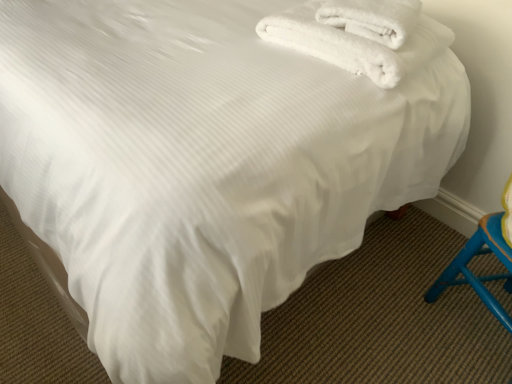
What do you see at coordinates (357, 37) in the screenshot?
I see `white fluffy towels at upper right, positioned as the second towel in right-to-left order` at bounding box center [357, 37].

Where is `white fluffy towels at upper right, the 1th towel in the left-to-right sequence`? The image size is (512, 384). white fluffy towels at upper right, the 1th towel in the left-to-right sequence is located at coordinates click(357, 37).

What is the approximate width of white fluffy towels at upper right, the 1th towel in the left-to-right sequence?

The width of white fluffy towels at upper right, the 1th towel in the left-to-right sequence, is 14.56 inches.

At what (x,y) coordinates should I click in order to perform the action: click on white fluffy towel at upper right, which is the second towel from left to right. Please return your answer as a coordinate pair (x, y). Looking at the image, I should click on (372, 18).

What is the approximate height of white fluffy towel at upper right, which is the first towel in right-to-left order?

white fluffy towel at upper right, which is the first towel in right-to-left order, is 2.32 inches tall.

In order to face white fluffy towel at upper right, which is the second towel from left to right, should I rotate leftwards or rightwards?

You should look right and rotate roughly 15.239 degrees.

What do you see at coordinates (372, 18) in the screenshot? I see `white fluffy towel at upper right, which is the second towel from left to right` at bounding box center [372, 18].

You are a GUI agent. You are given a task and a screenshot of the screen. Output one action in this format:
    pyautogui.click(x=<x>, y=<y>)
    Task: Click on the white fluffy towels at upper right, the 1th towel in the left-to-right sequence
    The height and width of the screenshot is (384, 512).
    Given the screenshot: What is the action you would take?
    pyautogui.click(x=357, y=37)

Based on their positions, is white fluffy towels at upper right, positioned as the second towel in right-to-left order, located to the left or right of white fluffy towel at upper right, which is the first towel in right-to-left order?

In the image, white fluffy towels at upper right, positioned as the second towel in right-to-left order, appears on the left side of white fluffy towel at upper right, which is the first towel in right-to-left order.

Which is in front, white fluffy towels at upper right, positioned as the second towel in right-to-left order, or white fluffy towel at upper right, which is the first towel in right-to-left order?

Positioned in front is white fluffy towels at upper right, positioned as the second towel in right-to-left order.

Does point (338, 34) lie in front of point (359, 9)?

That is True.

From the image's perspective, is white fluffy towels at upper right, the 1th towel in the left-to-right sequence, over white fluffy towel at upper right, which is the second towel from left to right?

Actually, white fluffy towels at upper right, the 1th towel in the left-to-right sequence, appears below white fluffy towel at upper right, which is the second towel from left to right, in the image.

From a real-world perspective, is white fluffy towels at upper right, the 1th towel in the left-to-right sequence, under white fluffy towel at upper right, which is the second towel from left to right?

Yes.

Which of these two, white fluffy towels at upper right, the 1th towel in the left-to-right sequence, or white fluffy towel at upper right, which is the first towel in right-to-left order, is wider?

white fluffy towels at upper right, the 1th towel in the left-to-right sequence, is wider.

Which of these two, white fluffy towels at upper right, the 1th towel in the left-to-right sequence, or white fluffy towel at upper right, which is the second towel from left to right, stands taller?

With more height is white fluffy towels at upper right, the 1th towel in the left-to-right sequence.

Who is bigger, white fluffy towels at upper right, positioned as the second towel in right-to-left order, or white fluffy towel at upper right, which is the first towel in right-to-left order?

white fluffy towels at upper right, positioned as the second towel in right-to-left order.

Choose the correct answer: Is white fluffy towels at upper right, positioned as the second towel in right-to-left order, inside white fluffy towel at upper right, which is the second towel from left to right, or outside it?

white fluffy towels at upper right, positioned as the second towel in right-to-left order, is outside white fluffy towel at upper right, which is the second towel from left to right.

In the scene shown: Are white fluffy towels at upper right, the 1th towel in the left-to-right sequence, and white fluffy towel at upper right, which is the second towel from left to right, beside each other?

Yes, white fluffy towels at upper right, the 1th towel in the left-to-right sequence, is with white fluffy towel at upper right, which is the second towel from left to right.

Is white fluffy towels at upper right, positioned as the second towel in right-to-left order, facing towards white fluffy towel at upper right, which is the second towel from left to right?

No, white fluffy towels at upper right, positioned as the second towel in right-to-left order, is not facing towards white fluffy towel at upper right, which is the second towel from left to right.

What's the angular difference between white fluffy towels at upper right, positioned as the second towel in right-to-left order, and white fluffy towel at upper right, which is the first towel in right-to-left order,'s facing directions?

The facing directions of white fluffy towels at upper right, positioned as the second towel in right-to-left order, and white fluffy towel at upper right, which is the first towel in right-to-left order, are 6.34 degrees apart.

Measure the distance between white fluffy towels at upper right, positioned as the second towel in right-to-left order, and white fluffy towel at upper right, which is the first towel in right-to-left order.

They are 1.32 inches apart.

The width and height of the screenshot is (512, 384). What are the coordinates of `towel on the right side of white fluffy towels at upper right, the 1th towel in the left-to-right sequence` in the screenshot? It's located at (372, 18).

Consider the image. Can you confirm if white fluffy towel at upper right, which is the second towel from left to right, is positioned to the right of white fluffy towels at upper right, the 1th towel in the left-to-right sequence?

Yes, white fluffy towel at upper right, which is the second towel from left to right, is to the right of white fluffy towels at upper right, the 1th towel in the left-to-right sequence.

Is white fluffy towel at upper right, which is the first towel in right-to-left order, behind white fluffy towels at upper right, the 1th towel in the left-to-right sequence?

Yes, the depth of white fluffy towel at upper right, which is the first towel in right-to-left order, is greater than that of white fluffy towels at upper right, the 1th towel in the left-to-right sequence.

Does point (401, 38) lie in front of point (340, 2)?

Yes, it is.

From the image's perspective, relative to white fluffy towels at upper right, positioned as the second towel in right-to-left order, is white fluffy towel at upper right, which is the first towel in right-to-left order, above or below?

white fluffy towel at upper right, which is the first towel in right-to-left order, is situated higher than white fluffy towels at upper right, positioned as the second towel in right-to-left order, in the image.

From a real-world perspective, is white fluffy towel at upper right, which is the first towel in right-to-left order, positioned under white fluffy towels at upper right, positioned as the second towel in right-to-left order, based on gravity?

No, from a real-world perspective, white fluffy towel at upper right, which is the first towel in right-to-left order, is not below white fluffy towels at upper right, positioned as the second towel in right-to-left order.

Considering the sizes of objects white fluffy towel at upper right, which is the second towel from left to right, and white fluffy towels at upper right, the 1th towel in the left-to-right sequence, in the image provided, who is wider, white fluffy towel at upper right, which is the second towel from left to right, or white fluffy towels at upper right, the 1th towel in the left-to-right sequence,?

Wider between the two is white fluffy towels at upper right, the 1th towel in the left-to-right sequence.

Considering the sizes of objects white fluffy towel at upper right, which is the second towel from left to right, and white fluffy towels at upper right, the 1th towel in the left-to-right sequence, in the image provided, who is taller, white fluffy towel at upper right, which is the second towel from left to right, or white fluffy towels at upper right, the 1th towel in the left-to-right sequence,?

white fluffy towels at upper right, the 1th towel in the left-to-right sequence.

Who is smaller, white fluffy towel at upper right, which is the second towel from left to right, or white fluffy towels at upper right, positioned as the second towel in right-to-left order?

With smaller size is white fluffy towel at upper right, which is the second towel from left to right.

Can white fluffy towels at upper right, positioned as the second towel in right-to-left order, be found inside white fluffy towel at upper right, which is the first towel in right-to-left order?

No, white fluffy towels at upper right, positioned as the second towel in right-to-left order, is not surrounded by white fluffy towel at upper right, which is the first towel in right-to-left order.

Are white fluffy towel at upper right, which is the second towel from left to right, and white fluffy towels at upper right, the 1th towel in the left-to-right sequence, located far from each other?

They are positioned close to each other.

Looking at this image, is white fluffy towels at upper right, positioned as the second towel in right-to-left order, at the back of white fluffy towel at upper right, which is the second towel from left to right?

That's not correct — white fluffy towel at upper right, which is the second towel from left to right, is not looking away from white fluffy towels at upper right, positioned as the second towel in right-to-left order.

Can you tell me how much white fluffy towel at upper right, which is the first towel in right-to-left order, and white fluffy towels at upper right, the 1th towel in the left-to-right sequence, differ in facing direction?

6.34 degrees separate the facing orientations of white fluffy towel at upper right, which is the first towel in right-to-left order, and white fluffy towels at upper right, the 1th towel in the left-to-right sequence.

At what (x,y) coordinates should I click in order to perform the action: click on towel in front of the white fluffy towel at upper right, which is the first towel in right-to-left order. Please return your answer as a coordinate pair (x, y). The height and width of the screenshot is (384, 512). Looking at the image, I should click on (357, 37).

The height and width of the screenshot is (384, 512). Find the location of `towel lying on the right of white fluffy towels at upper right, positioned as the second towel in right-to-left order`. towel lying on the right of white fluffy towels at upper right, positioned as the second towel in right-to-left order is located at coordinates (372, 18).

You are a GUI agent. You are given a task and a screenshot of the screen. Output one action in this format:
    pyautogui.click(x=<x>, y=<y>)
    Task: Click on the towel that is behind the white fluffy towels at upper right, the 1th towel in the left-to-right sequence
    The height and width of the screenshot is (384, 512).
    Given the screenshot: What is the action you would take?
    pyautogui.click(x=372, y=18)